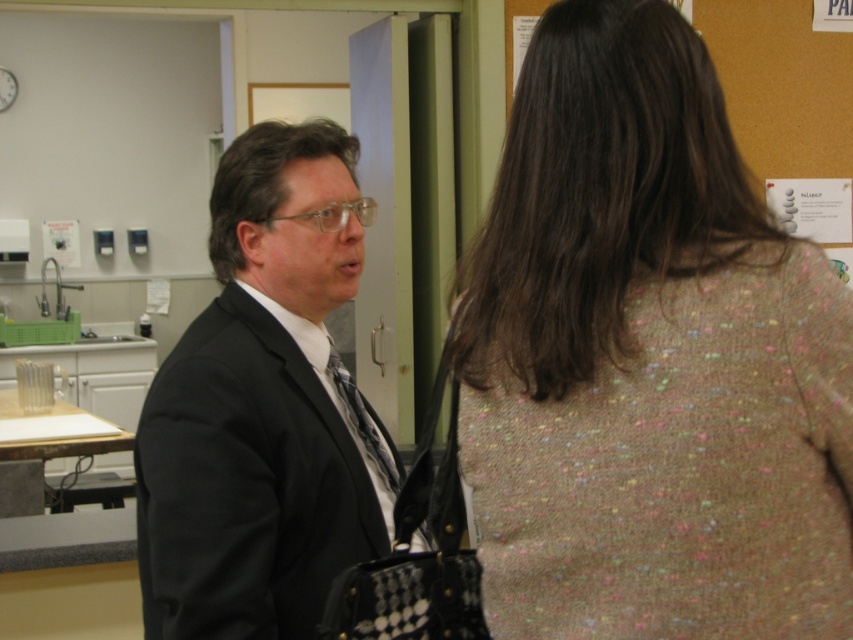
You are a tailor measuring the distance between two clothing items in the scene. The speckled wool sweater at upper right belongs to a woman facing away, while the patterned silk tie at center is part of a man in formal attire. Can your measuring tape reach the 24 inches required to connect them?

The distance between the speckled wool sweater at upper right and the patterned silk tie at center is 23.02 inches. Since the required 24 inches is longer than the actual distance, the measuring tape does not need to extend fully. It can easily reach the 23.02 inches between them.

You are a security guard who needs to approach the black matte suit at center to check for prohibited items. The minimum safe distance for a security check is 1.2 meters. Can you safely perform the check from your current position?

They are 1.22 meters apart. Since the minimum safe distance is 1.2 meters, you can safely perform the check as the distance is sufficient.

You are a photographer setting up for a formal event. You need to position a spotlight on the black matte suit at center and another on the patterned silk tie at center. According to the scene, which object should you place the spotlight to the right of?

The patterned silk tie at center should have the spotlight placed to its right because the black matte suit at center is positioned to the left of the patterned silk tie at center.